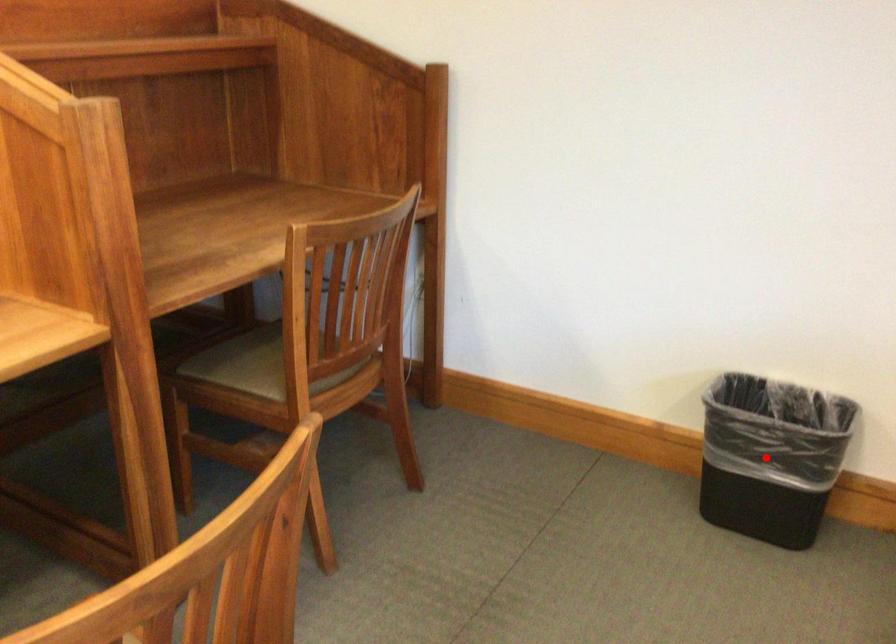
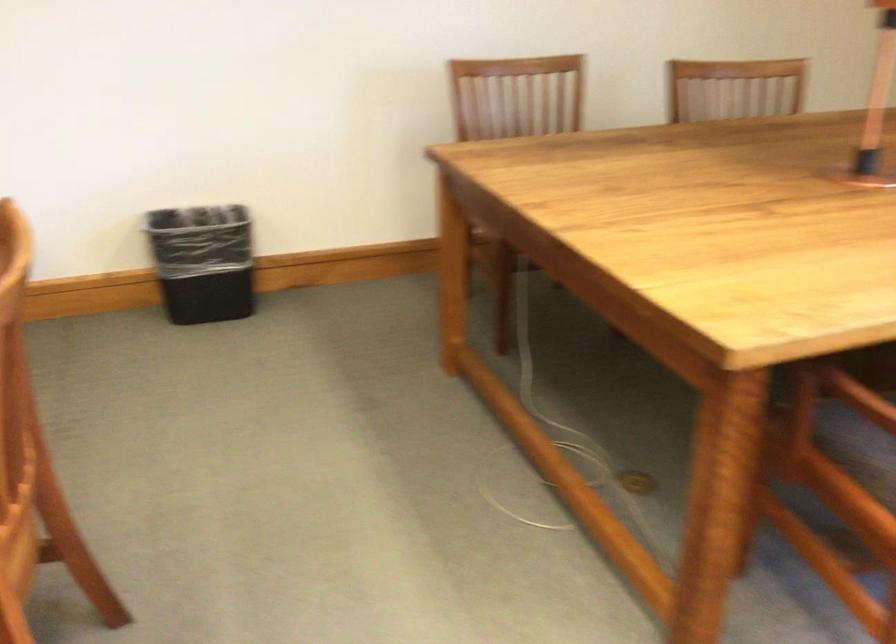
Question: I am providing you with two images of the same scene from different viewpoints. A red point is shown in image1. For the corresponding object point in image2, is it positioned nearer or farther from the camera?

Choices:
 (A) Nearer
 (B) Farther

Answer: (B)